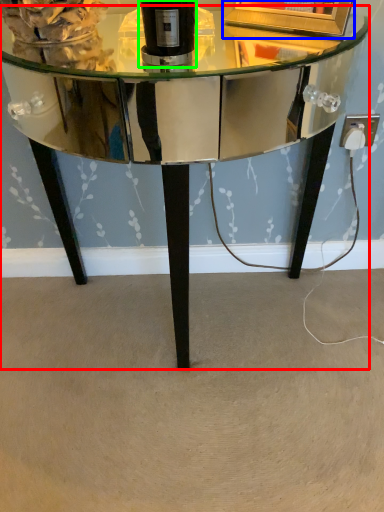
Question: Which object is the closest to the table (highlighted by a red box)? Choose among these: picture frame (highlighted by a blue box) or bottle (highlighted by a green box).

Choices:
 (A) picture frame
 (B) bottle

Answer: (A)